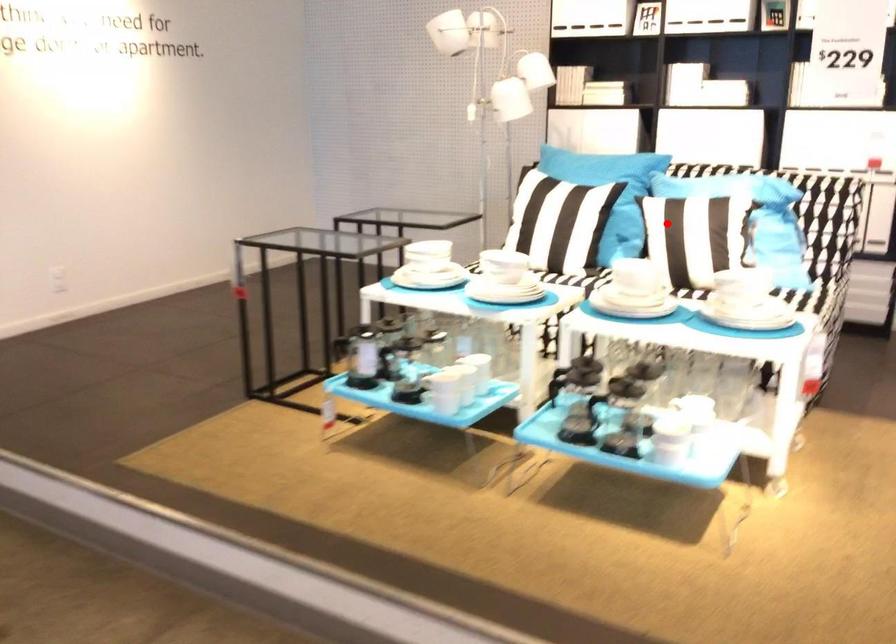
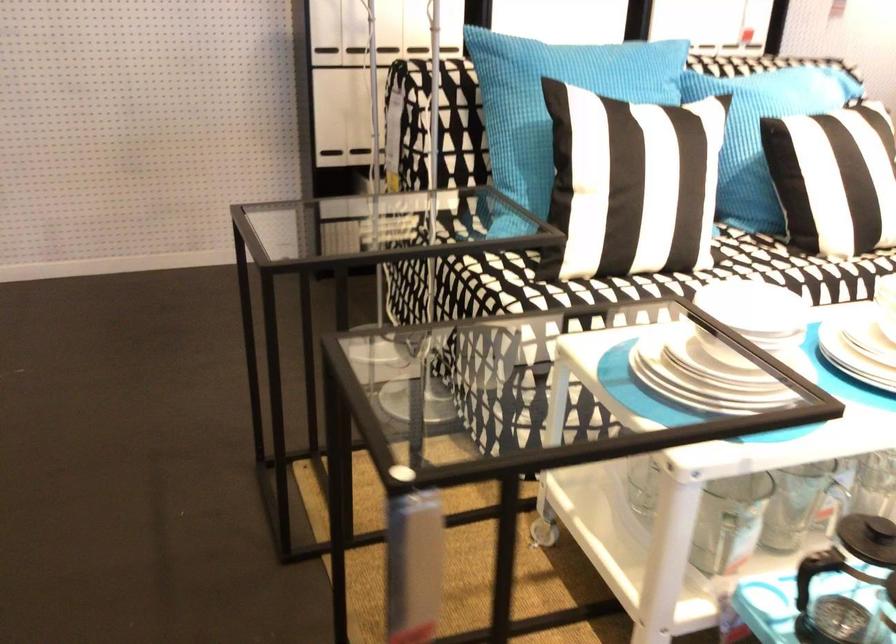
Find the pixel in the second image that matches the highlighted location in the first image.

(833, 178)